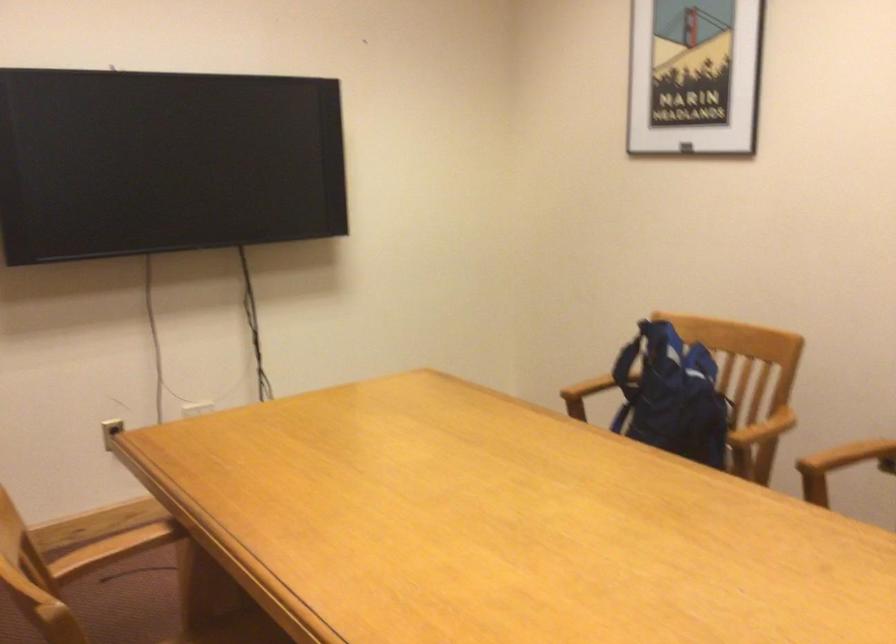
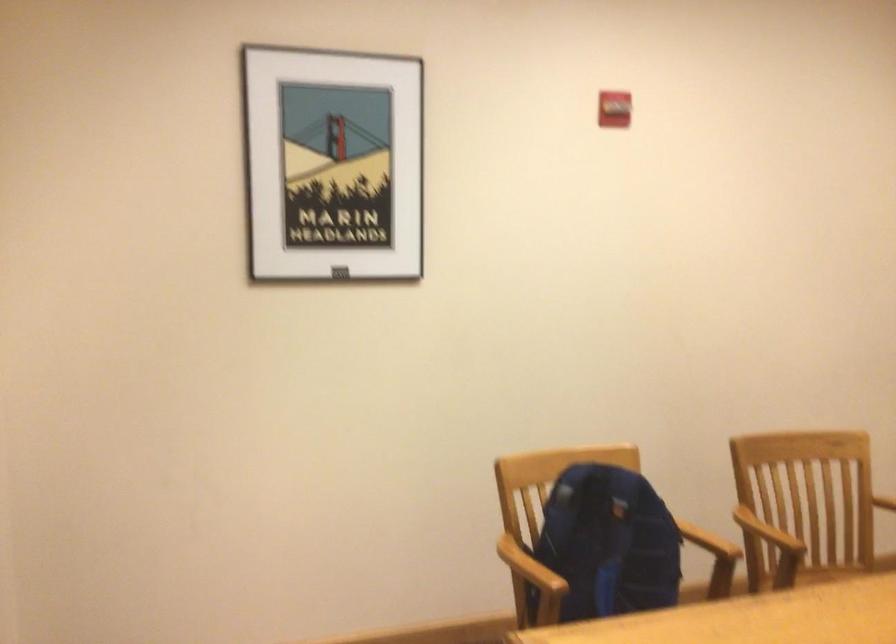
Locate, in the second image, the point that corresponds to the point at 649,393 in the first image.

(607, 544)